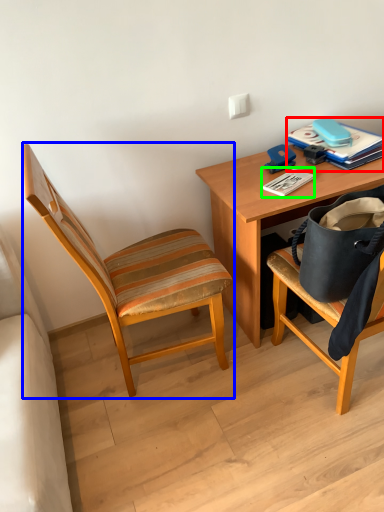
Question: Which object is positioned closest to paperback book (highlighted by a red box)? Select from chair (highlighted by a blue box) and paperback book (highlighted by a green box).

Choices:
 (A) chair
 (B) paperback book

Answer: (B)